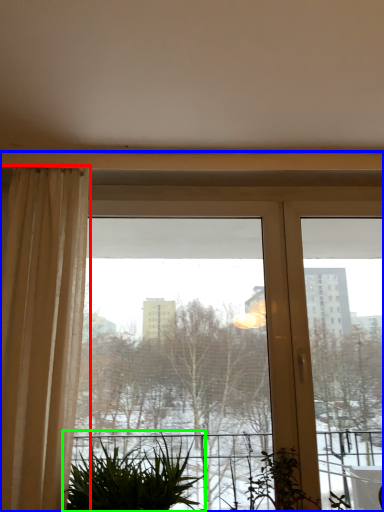
Question: Considering the real-world distances, which object is farthest from curtain (highlighted by a red box)? window (highlighted by a blue box) or houseplant (highlighted by a green box)?

Choices:
 (A) window
 (B) houseplant

Answer: (A)